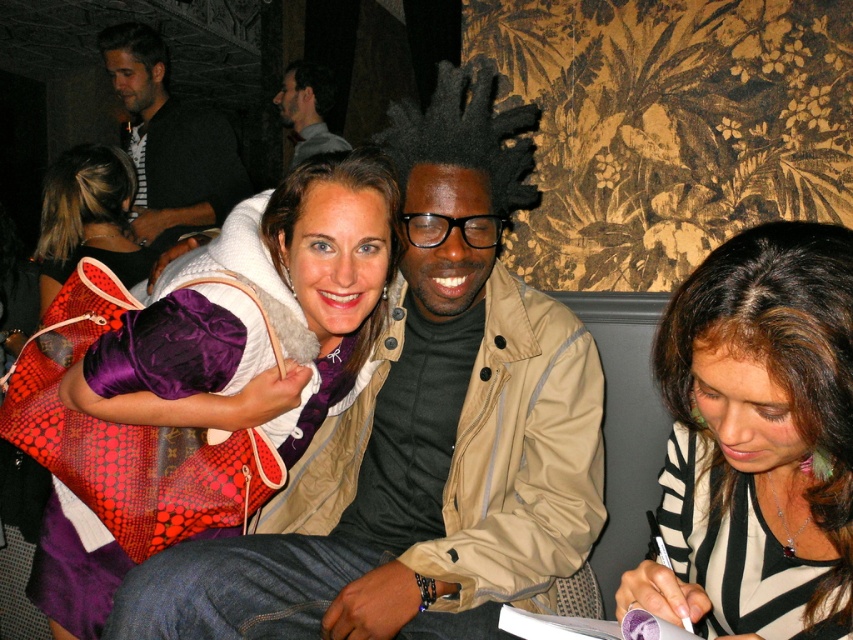
Between point (277, 248) and point (289, 160), which one is positioned in front?

Point (277, 248) is in front.

At what (x,y) coordinates should I click in order to perform the action: click on purple velvet bag at center. Please return your answer as a coordinate pair (x, y). Looking at the image, I should click on (322, 273).

Locate an element on the screen. The width and height of the screenshot is (853, 640). striped fabric shirt at lower right is located at coordinates (757, 438).

The image size is (853, 640). In order to click on striped fabric shirt at lower right in this screenshot , I will do `click(757, 438)`.

At what (x,y) coordinates should I click in order to perform the action: click on striped fabric shirt at lower right. Please return your answer as a coordinate pair (x, y). This screenshot has height=640, width=853. Looking at the image, I should click on (757, 438).

Is brushed metal jacket at upper left thinner than gray sweater at upper left?

Incorrect, brushed metal jacket at upper left's width is not less than gray sweater at upper left's.

Who is taller, brushed metal jacket at upper left or gray sweater at upper left?

brushed metal jacket at upper left is taller.

What do you see at coordinates (170, 141) in the screenshot? I see `brushed metal jacket at upper left` at bounding box center [170, 141].

Locate an element on the screen. The image size is (853, 640). brushed metal jacket at upper left is located at coordinates (170, 141).